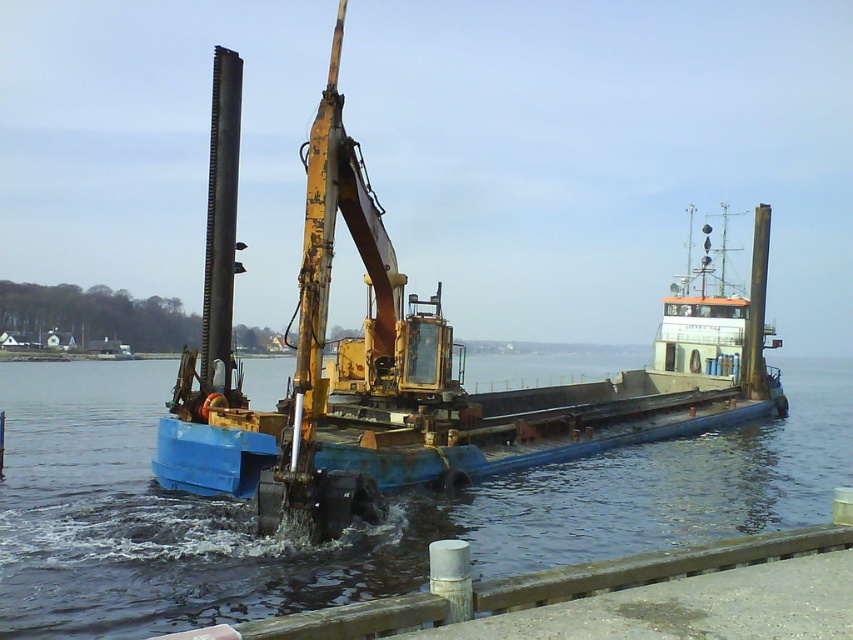
Question: Can you confirm if blue metallic water at center is thinner than blue painted steel barge at center?

Choices:
 (A) yes
 (B) no

Answer: (B)

Question: Which object is closer to the camera taking this photo?

Choices:
 (A) blue painted steel barge at center
 (B) blue metallic water at center

Answer: (B)

Question: Can you confirm if blue metallic water at center is thinner than blue painted steel barge at center?

Choices:
 (A) yes
 (B) no

Answer: (B)

Question: Does blue metallic water at center appear over blue painted steel barge at center?

Choices:
 (A) no
 (B) yes

Answer: (A)